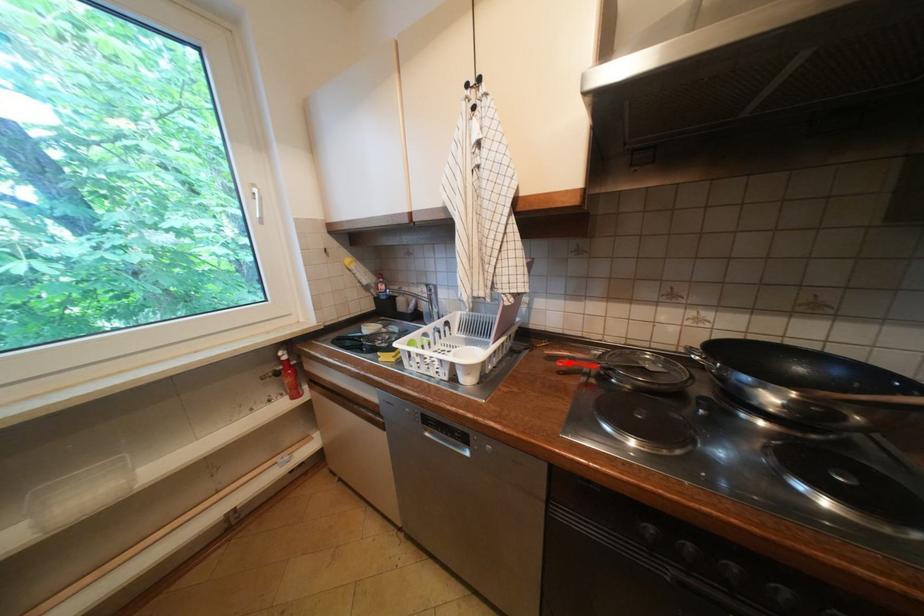
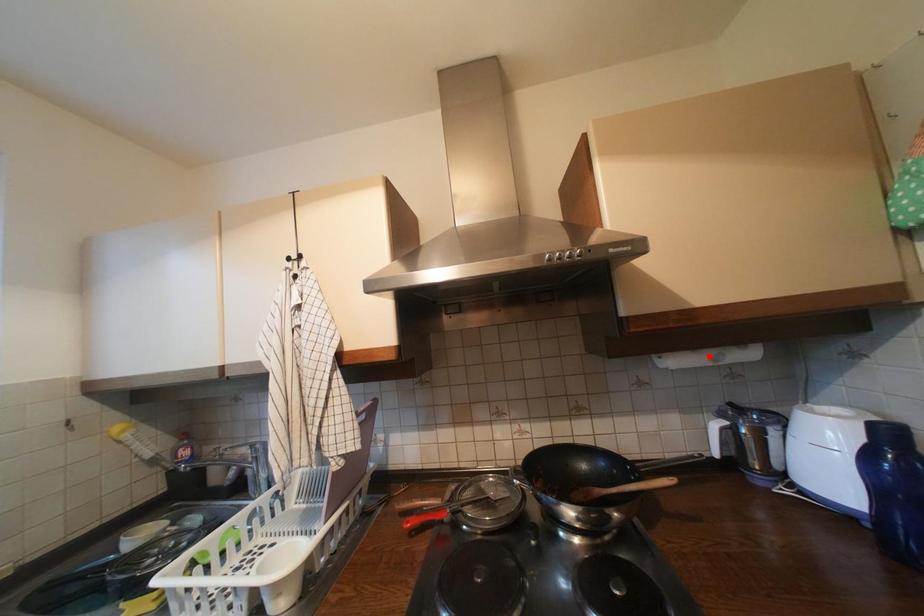
I am providing you with two images of the same scene from different viewpoints. A red point is marked on the first image and another point is marked on the second image. Do the highlighted points in image1 and image2 indicate the same real-world spot?

No